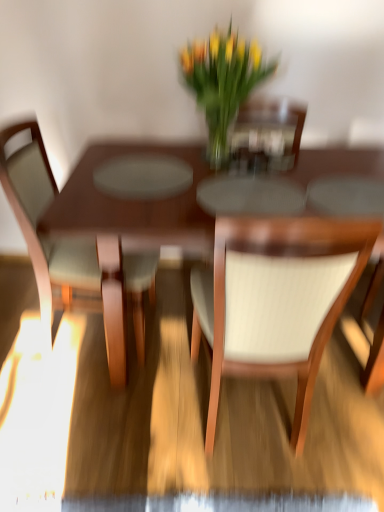
Find the location of a particular element. The image size is (384, 512). free spot to the right of white textured chair at center, which appears as the second chair when viewed from the left is located at coordinates (343, 417).